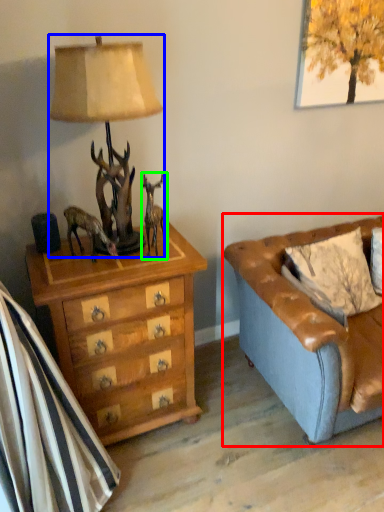
Question: Based on their relative distances, which object is nearer to studio couch (highlighted by a red box)? Choose from lamp (highlighted by a blue box) and reindeer (highlighted by a green box).

Choices:
 (A) lamp
 (B) reindeer

Answer: (B)